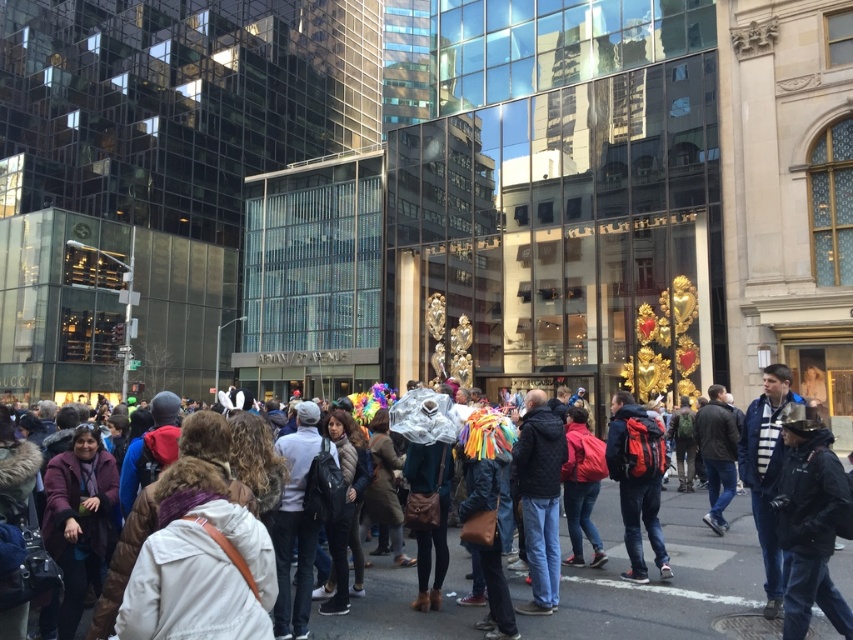
You are a photographer trying to capture both the dark brown leather jacket at center and the red backpack at center in the same frame. Which object should you focus on first to ensure both are in the frame?

You should focus on the dark brown leather jacket at center first because its width is larger than the red backpack at center, so positioning it properly will help include both in the frame.

You are a photographer trying to capture both the dark brown leather jacket at center and the black quilted jacket at center in the same frame. Which jacket should you adjust your camera angle to focus on first to ensure both are in the shot?

The dark brown leather jacket at center is positioned on the left side of black quilted jacket at center. Therefore, you should focus on the dark brown leather jacket at center first to ensure both are included in the frame.

You are a photographer trying to capture a candid shot of the black quilted jacket at center and dark blue jeans at center in the bustling urban scene. Since you want to ensure both are visible in the frame, which object should you focus on first to ensure the other remains in the shot?

The black quilted jacket at center occupies less space than dark blue jeans at center, so you should focus on the dark blue jeans at center first since it takes up more space and will help keep the smaller black quilted jacket at center within the frame.